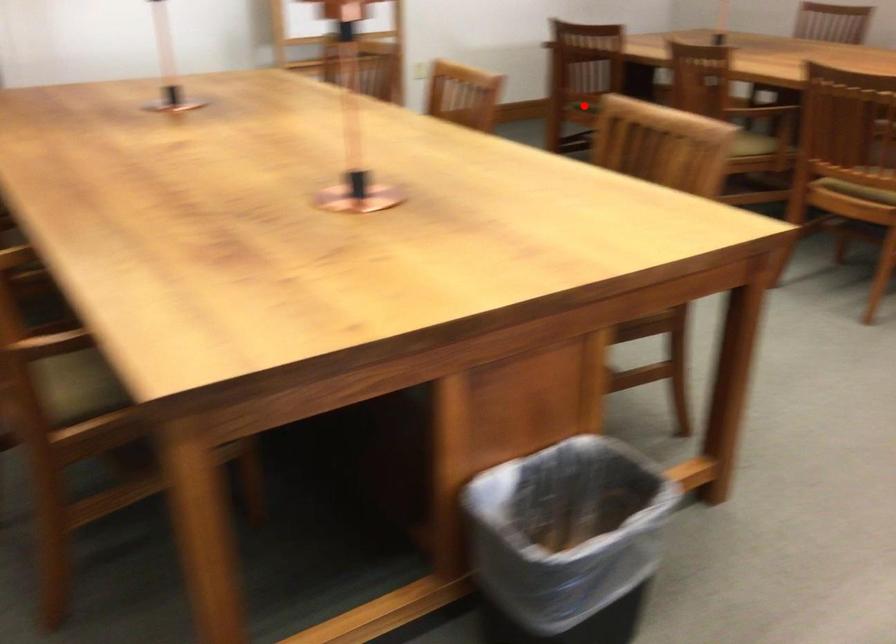
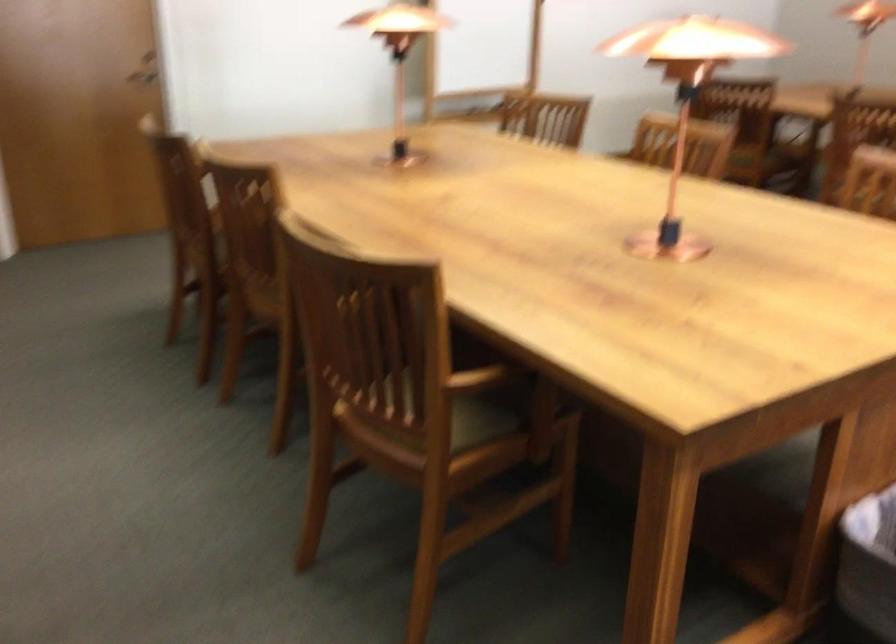
Question: I am providing you with two images of the same scene from different viewpoints. A red point is marked on the first image. Is the red point's position out of view in image 2?

Choices:
 (A) Yes
 (B) No

Answer: (A)